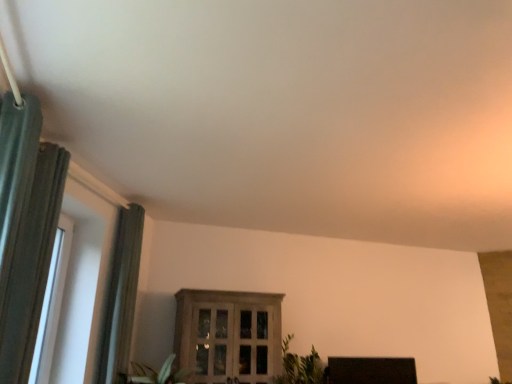
Question: Can you confirm if white plastic window at left, the second window viewed from the back, is positioned to the right of wooden cabinet at center, which appears as the first window when viewed from the back?

Choices:
 (A) yes
 (B) no

Answer: (B)

Question: From a real-world perspective, is white plastic window at left, which is counted as the second window, starting from the right, over wooden cabinet at center, the 2th window when ordered from left to right?

Choices:
 (A) yes
 (B) no

Answer: (A)

Question: Does white plastic window at left, which is counted as the second window, starting from the right, have a lesser width compared to wooden cabinet at center, placed as the 1th window when sorted from right to left?

Choices:
 (A) no
 (B) yes

Answer: (B)

Question: Is white plastic window at left, which is counted as the second window, starting from the right, further to the viewer compared to wooden cabinet at center, which appears as the first window when viewed from the back?

Choices:
 (A) no
 (B) yes

Answer: (A)

Question: Is white plastic window at left, the second window viewed from the back, bigger than wooden cabinet at center, the 2th window when ordered from left to right?

Choices:
 (A) yes
 (B) no

Answer: (B)

Question: Is the position of white plastic window at left, the second window viewed from the back, less distant than that of wooden cabinet at center, which appears as the 2th window when viewed from the front?

Choices:
 (A) no
 (B) yes

Answer: (B)

Question: Is green leafy plant at lower center surrounded by green textured curtain at left, positioned as the first curtain in back-to-front order?

Choices:
 (A) no
 (B) yes

Answer: (A)

Question: Does green textured curtain at left, acting as the 2th curtain starting from the front, come in front of green leafy plant at lower center?

Choices:
 (A) yes
 (B) no

Answer: (A)

Question: From the image's perspective, does green textured curtain at left, acting as the 2th curtain starting from the front, appear lower than green leafy plant at lower center?

Choices:
 (A) no
 (B) yes

Answer: (A)

Question: Considering the relative sizes of green textured curtain at left, acting as the 2th curtain starting from the front, and green leafy plant at lower center in the image provided, is green textured curtain at left, acting as the 2th curtain starting from the front, smaller than green leafy plant at lower center?

Choices:
 (A) no
 (B) yes

Answer: (B)

Question: Is green textured curtain at left, positioned as the first curtain in back-to-front order, wider than green leafy plant at lower center?

Choices:
 (A) no
 (B) yes

Answer: (A)

Question: Would you say green textured curtain at left, acting as the 2th curtain starting from the front, is outside green leafy plant at lower center?

Choices:
 (A) no
 (B) yes

Answer: (B)

Question: Is wooden cabinet at center, the 2th window when ordered from left to right, taller than black matte tv at lower right?

Choices:
 (A) no
 (B) yes

Answer: (B)